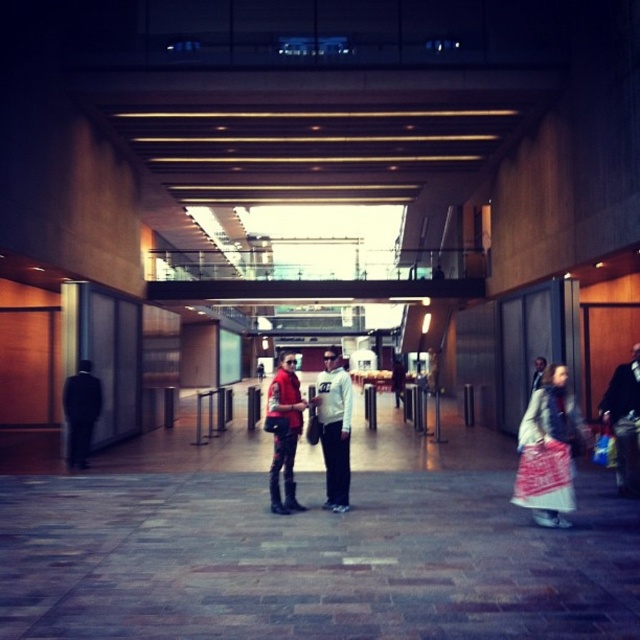
Question: Can you confirm if white cotton shirt at center is positioned below matte black jacket at right?

Choices:
 (A) yes
 (B) no

Answer: (A)

Question: Which point is closer to the camera taking this photo?

Choices:
 (A) (632, 449)
 (B) (74, 384)
 (C) (532, 493)

Answer: (C)

Question: Is white cotton dress at lower right below dark suit at left?

Choices:
 (A) yes
 (B) no

Answer: (B)

Question: Which of these objects is positioned closest to the white cotton dress at lower right?

Choices:
 (A) matte black jacket at right
 (B) matte red vest at center
 (C) dark suit at left

Answer: (A)

Question: Does matte black jacket at right appear under dark suit at left?

Choices:
 (A) no
 (B) yes

Answer: (A)

Question: Which point appears farthest from the camera in this image?

Choices:
 (A) (72, 397)
 (B) (548, 502)
 (C) (294, 509)
 (D) (337, 481)

Answer: (A)